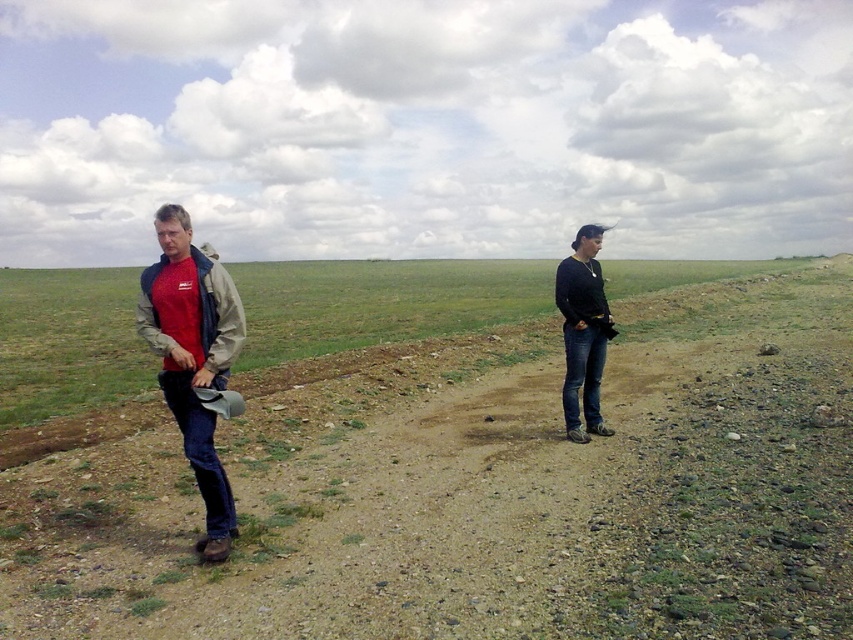
Question: Which point appears farthest from the camera in this image?

Choices:
 (A) (491, 544)
 (B) (144, 284)
 (C) (587, 316)

Answer: (C)

Question: Which object appears closest to the camera in this image?

Choices:
 (A) dirt at center
 (B) matte red shirt at left
 (C) black matte jacket at right

Answer: (A)

Question: Is dirt at center above matte red shirt at left?

Choices:
 (A) yes
 (B) no

Answer: (A)

Question: Among these objects, which one is farthest from the camera?

Choices:
 (A) black matte jacket at right
 (B) dirt at center
 (C) matte red shirt at left

Answer: (A)

Question: Does dirt at center have a smaller size compared to matte red shirt at left?

Choices:
 (A) no
 (B) yes

Answer: (A)

Question: Does dirt at center appear under black matte jacket at right?

Choices:
 (A) yes
 (B) no

Answer: (B)